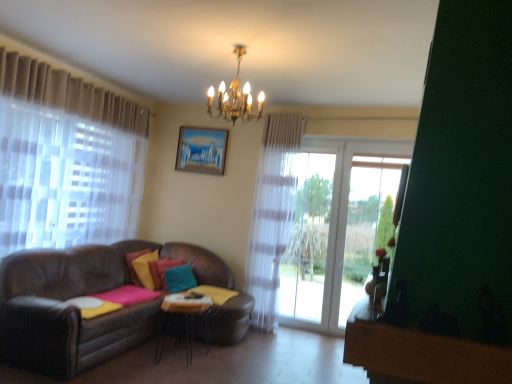
Question: From a real-world perspective, is metallic silver table at center above or below teal matte pillow at center, placed as the second pillow when sorted from left to right?

Choices:
 (A) below
 (B) above

Answer: (A)

Question: In the image, is metallic silver table at center positioned in front of or behind teal matte pillow at center, placed as the second pillow when sorted from left to right?

Choices:
 (A) behind
 (B) front

Answer: (B)

Question: Which object is positioned closest to the teal matte pillow at center, the second pillow positioned from the right?

Choices:
 (A) gold metallic chandelier at upper center
 (B) velvet yellow pillow at center, the 1th pillow positioned from the left
 (C) teal matte pillow at center, arranged as the third pillow when viewed from the left
 (D) matte wooden picture frame at upper center
 (E) metallic silver table at center

Answer: (C)

Question: Estimate the real-world distances between objects in this image. Which object is farther from the teal matte pillow at center, which is the 1th pillow from right to left?

Choices:
 (A) metallic silver table at center
 (B) gold metallic chandelier at upper center
 (C) teal matte pillow at center, placed as the second pillow when sorted from left to right
 (D) velvet yellow pillow at center, which is the 3th pillow in right-to-left order
 (E) matte wooden picture frame at upper center

Answer: (B)